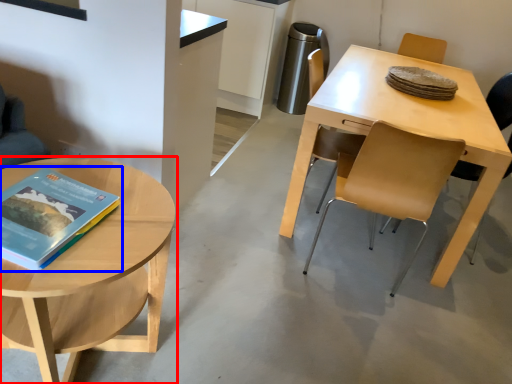
Question: Which of the following is the farthest to the observer, coffee table (highlighted by a red box) or book (highlighted by a blue box)?

Choices:
 (A) coffee table
 (B) book

Answer: (B)